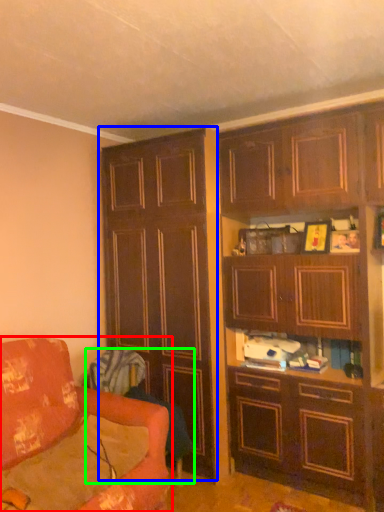
Question: Which is nearer to the studio couch (highlighted by a red box)? cabinetry (highlighted by a blue box) or swivel chair (highlighted by a green box).

Choices:
 (A) cabinetry
 (B) swivel chair

Answer: (B)